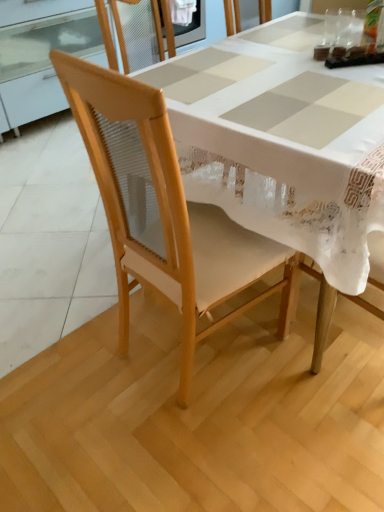
Question: From the image's perspective, is transparent plastic cup at upper right, the 2th tableware from the right, beneath natural wood chair at center?

Choices:
 (A) yes
 (B) no

Answer: (B)

Question: Is natural wood chair at center at the back of transparent plastic cup at upper right, placed as the first tableware when sorted from left to right?

Choices:
 (A) yes
 (B) no

Answer: (B)

Question: Is transparent plastic cup at upper right, placed as the first tableware when sorted from left to right, completely or partially outside of natural wood chair at center?

Choices:
 (A) no
 (B) yes

Answer: (B)

Question: Does transparent plastic cup at upper right, the 2th tableware from the right, lie behind natural wood chair at center?

Choices:
 (A) no
 (B) yes

Answer: (B)

Question: Considering the relative sizes of transparent plastic cup at upper right, placed as the first tableware when sorted from left to right, and natural wood chair at center in the image provided, is transparent plastic cup at upper right, placed as the first tableware when sorted from left to right, smaller than natural wood chair at center?

Choices:
 (A) no
 (B) yes

Answer: (B)

Question: Is transparent glass at upper center, which ranks as the second tableware in left-to-right order, taller or shorter than transparent plastic cup at upper right, placed as the first tableware when sorted from left to right?

Choices:
 (A) short
 (B) tall

Answer: (B)

Question: Considering their positions, is transparent glass at upper center, placed as the first tableware when sorted from right to left, located in front of or behind transparent plastic cup at upper right, placed as the first tableware when sorted from left to right?

Choices:
 (A) behind
 (B) front

Answer: (A)

Question: Is transparent glass at upper center, which ranks as the second tableware in left-to-right order, bigger or smaller than transparent plastic cup at upper right, placed as the first tableware when sorted from left to right?

Choices:
 (A) big
 (B) small

Answer: (A)

Question: From a real-world perspective, relative to transparent plastic cup at upper right, placed as the first tableware when sorted from left to right, is transparent glass at upper center, placed as the first tableware when sorted from right to left, vertically above or below?

Choices:
 (A) above
 (B) below

Answer: (A)

Question: Is natural wood chair at center taller or shorter than transparent plastic cup at upper right, placed as the first tableware when sorted from left to right?

Choices:
 (A) short
 (B) tall

Answer: (B)

Question: From a real-world perspective, is natural wood chair at center physically located above or below transparent plastic cup at upper right, the 2th tableware from the right?

Choices:
 (A) below
 (B) above

Answer: (A)

Question: Visually, is natural wood chair at center positioned to the left or to the right of transparent plastic cup at upper right, placed as the first tableware when sorted from left to right?

Choices:
 (A) right
 (B) left

Answer: (B)

Question: Is natural wood chair at center in front of or behind transparent plastic cup at upper right, placed as the first tableware when sorted from left to right, in the image?

Choices:
 (A) behind
 (B) front

Answer: (B)

Question: In the image, is natural wood chair at center positioned in front of or behind transparent glass at upper center, placed as the first tableware when sorted from right to left?

Choices:
 (A) front
 (B) behind

Answer: (A)

Question: From a real-world perspective, is natural wood chair at center positioned above or below transparent glass at upper center, placed as the first tableware when sorted from right to left?

Choices:
 (A) below
 (B) above

Answer: (A)